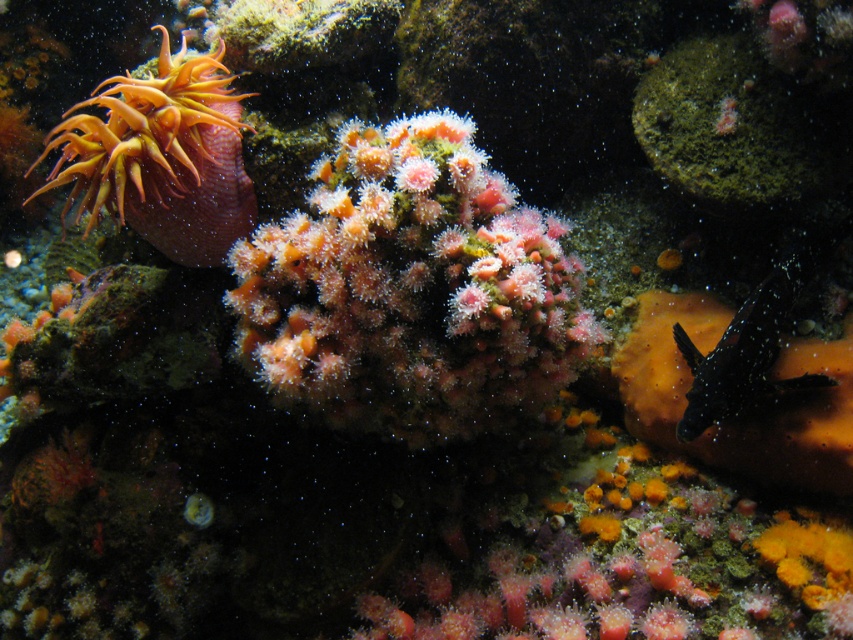
Is pink fuzzy coral at center shorter than orange soft coral at upper left?

In fact, pink fuzzy coral at center may be taller than orange soft coral at upper left.

Which is below, pink fuzzy coral at center or orange soft coral at upper left?

pink fuzzy coral at center is lower down.

Is point (358, 403) behind point (160, 164)?

Yes.

Locate an element on the screen. pink fuzzy coral at center is located at coordinates (410, 291).

Does pink fuzzy coral at center have a larger size compared to black dotted clownfish at right?

Correct, pink fuzzy coral at center is larger in size than black dotted clownfish at right.

Does pink fuzzy coral at center have a greater height compared to black dotted clownfish at right?

Yes.

Which is behind, point (428, 285) or point (695, 372)?

The point (695, 372) is more distant.

The width and height of the screenshot is (853, 640). Identify the location of pink fuzzy coral at center. (410, 291).

Does orange soft coral at upper left appear over black dotted clownfish at right?

Yes.

Is orange soft coral at upper left positioned at the back of black dotted clownfish at right?

No, it is not.

Is point (128, 141) less distant than point (695, 369)?

Yes.

Where is `orange soft coral at upper left`? The image size is (853, 640). orange soft coral at upper left is located at coordinates click(142, 134).